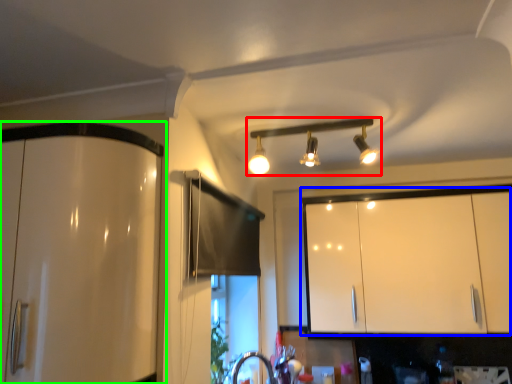
Question: Based on their relative distances, which object is farther from lamp (highlighted by a red box)? Choose from cabinetry (highlighted by a blue box) and cabinetry (highlighted by a green box).

Choices:
 (A) cabinetry
 (B) cabinetry

Answer: (B)